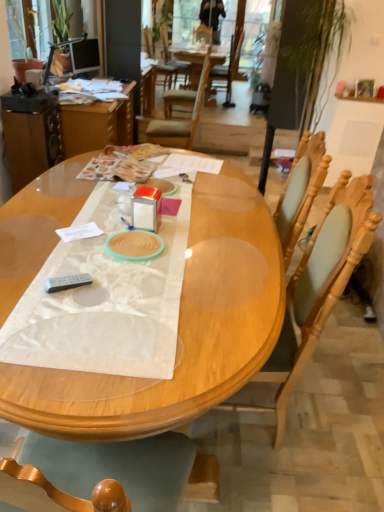
This screenshot has width=384, height=512. Find the location of `free space in front of gray matte remote control at lower left`. free space in front of gray matte remote control at lower left is located at coordinates (59, 320).